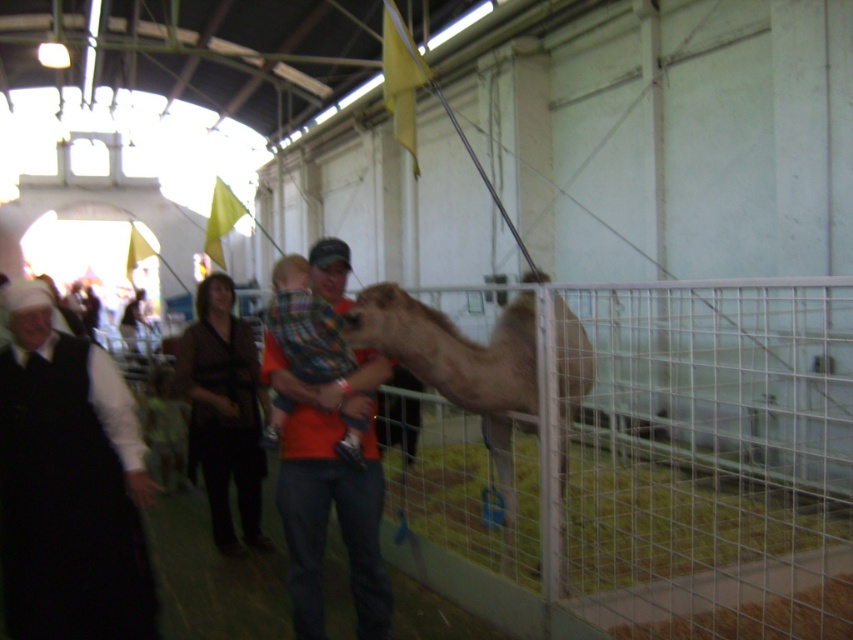
Does white wire fence at right have a smaller size compared to black fabric at left?

No.

Is white wire fence at right in front of black fabric at left?

No, white wire fence at right is behind black fabric at left.

Does point (836, 605) lie behind point (16, 387)?

Yes.

Locate an element on the screen. The width and height of the screenshot is (853, 640). white wire fence at right is located at coordinates pyautogui.click(x=628, y=456).

Looking at this image, who is higher up, black fabric at left or orange cotton shirt at center?

orange cotton shirt at center is higher up.

Which is in front, point (20, 384) or point (289, 440)?

Point (20, 384)

Which is behind, point (16, 332) or point (345, 244)?

The point (345, 244) is behind.

The width and height of the screenshot is (853, 640). Find the location of `black fabric at left`. black fabric at left is located at coordinates (68, 486).

In the scene shown: Which of these two, white wire fence at right or orange cotton shirt at center, stands taller?

Standing taller between the two is white wire fence at right.

Is white wire fence at right to the right of orange cotton shirt at center from the viewer's perspective?

Yes, white wire fence at right is to the right of orange cotton shirt at center.

Does point (526, 584) come behind point (347, 260)?

Yes, point (526, 584) is behind point (347, 260).

In order to click on white wire fence at right in this screenshot , I will do `click(628, 456)`.